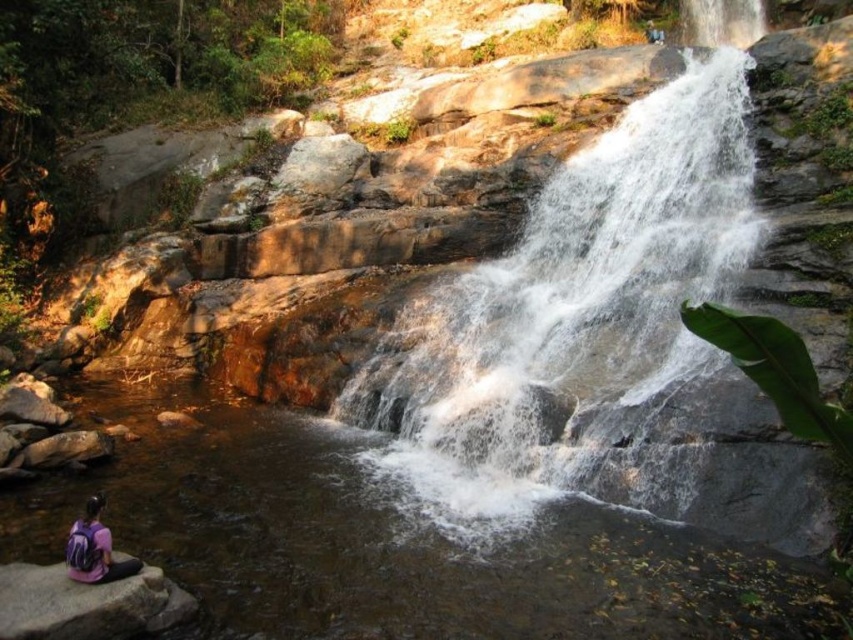
You are standing at the camera position and want to throw a small stone into the white frothy water at center. Based on the distance provided, can you estimate if a typical adult can accurately throw a stone that far?

The white frothy water at center is 9.75 meters away from the camera. A typical adult can throw a stone up to around 15 meters, so it is possible to accurately throw a stone that far.

You are planning to cross the gray rock at lower left to reach the white frothy water at center. Considering their sizes, which one do you think will be easier to step on?

The gray rock at lower left is smaller than the white frothy water at center, so stepping on the gray rock at lower left might be easier as it requires less space to navigate.